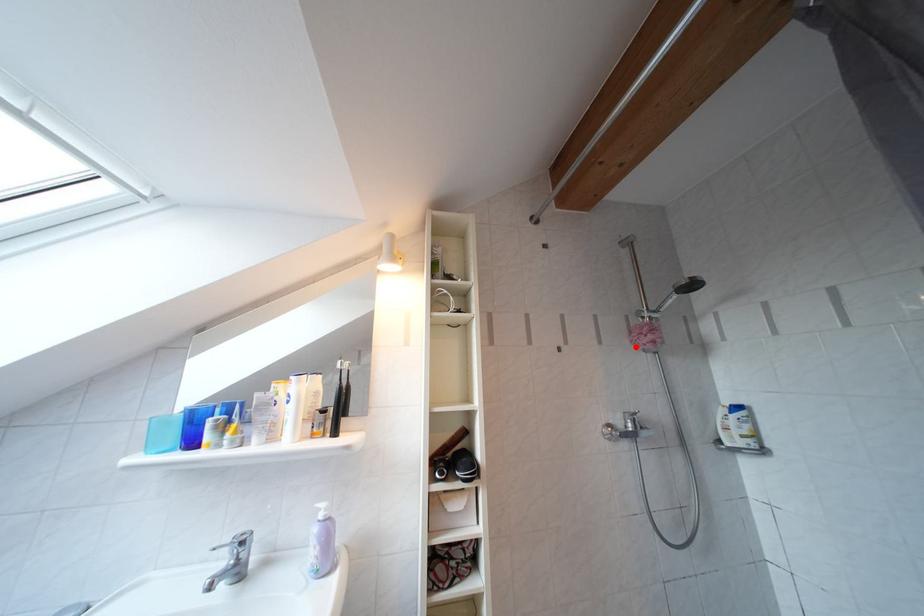
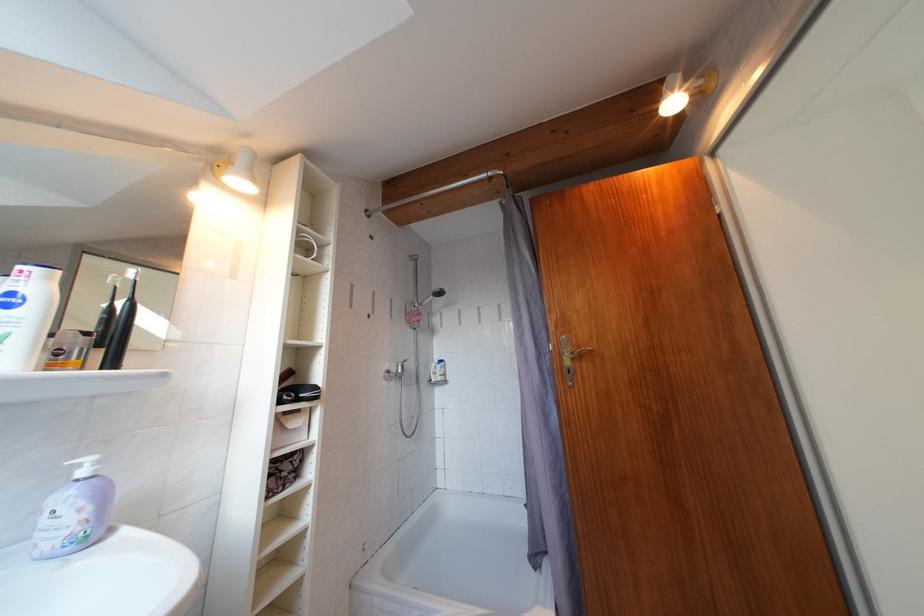
The point at the highlighted location is marked in the first image. Where is the corresponding point in the second image?

(411, 325)